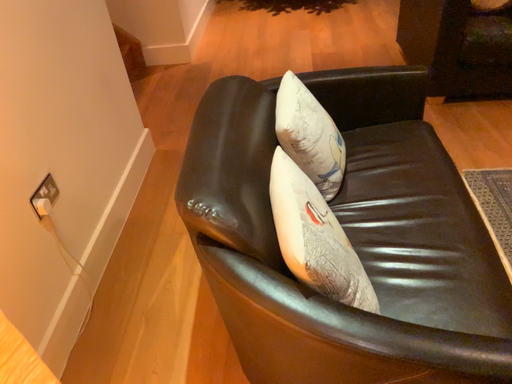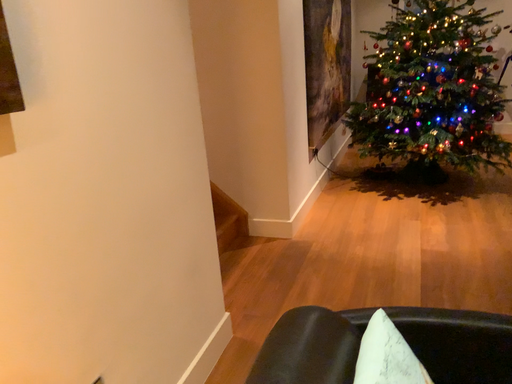
Question: How did the camera likely rotate when shooting the video?

Choices:
 (A) rotated upward
 (B) rotated downward

Answer: (A)